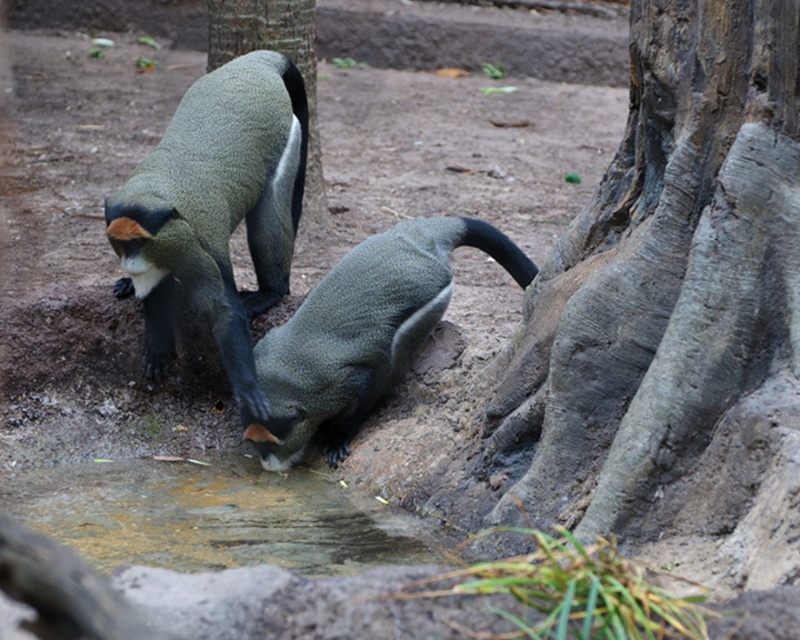
Question: Estimate the real-world distances between objects in this image. Which object is farther from the gray rough bark tree trunk at right?

Choices:
 (A) green textured monkey at upper center
 (B) black fuzzy tail at center
 (C) soft gray fur monkey at center
 (D) gray furry monkey at center

Answer: (A)

Question: Does gray rough bark tree trunk at right appear under brown dirt puddle at lower center?

Choices:
 (A) no
 (B) yes

Answer: (A)

Question: Which of the following is the farthest from the observer?

Choices:
 (A) soft gray fur monkey at center
 (B) brown dirt puddle at lower center
 (C) black fuzzy tail at center
 (D) gray furry monkey at center

Answer: (C)

Question: Is gray furry monkey at center closer to camera compared to black fuzzy tail at center?

Choices:
 (A) no
 (B) yes

Answer: (B)

Question: Where is gray rough bark tree trunk at right located in relation to green textured monkey at upper center in the image?

Choices:
 (A) above
 (B) below

Answer: (B)

Question: Which object is positioned farthest from the soft gray fur monkey at center?

Choices:
 (A) black fuzzy tail at center
 (B) gray furry monkey at center
 (C) green textured monkey at upper center

Answer: (C)